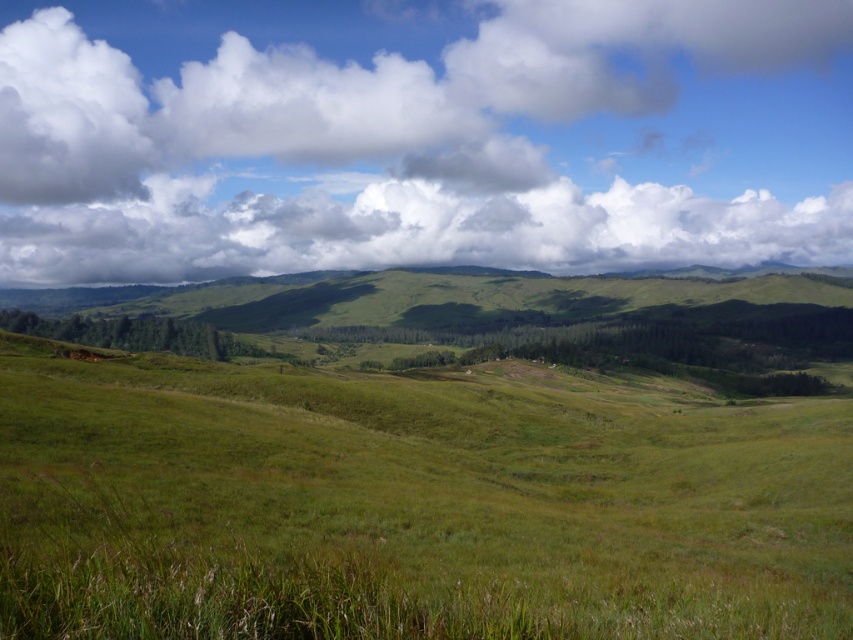
Question: Which of the following is the closest to the observer?

Choices:
 (A) white fluffy cloud at upper center
 (B) green grassy field at center

Answer: (B)

Question: Can you confirm if green grassy field at center is smaller than white fluffy cloud at upper center?

Choices:
 (A) no
 (B) yes

Answer: (B)

Question: Is green grassy field at center to the right of white fluffy cloud at upper center from the viewer's perspective?

Choices:
 (A) yes
 (B) no

Answer: (A)

Question: Is green grassy field at center behind white fluffy cloud at upper center?

Choices:
 (A) no
 (B) yes

Answer: (A)

Question: Which point appears farthest from the camera in this image?

Choices:
 (A) (111, 424)
 (B) (134, 54)

Answer: (B)